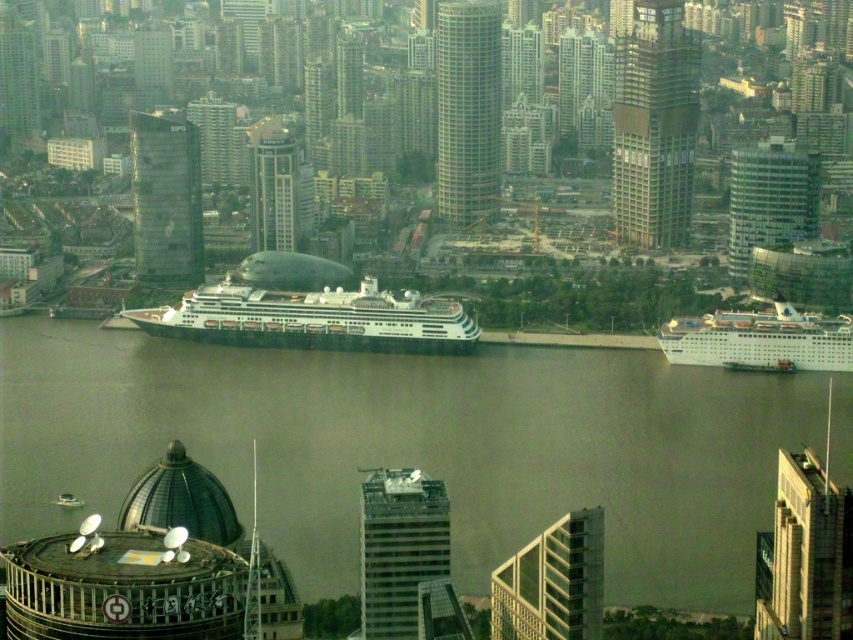
Question: Can you confirm if metallic glass skyscraper at center is bigger than white glossy cruise ship at right?

Choices:
 (A) no
 (B) yes

Answer: (A)

Question: Which point appears closest to the camera in this image?

Choices:
 (A) click(293, 179)
 (B) click(753, 368)
 (C) click(207, 134)
 (D) click(164, 132)

Answer: (A)

Question: Which point is closer to the camera?

Choices:
 (A) (70, 500)
 (B) (523, 566)
 (C) (173, 250)
 (D) (218, 163)

Answer: (B)

Question: Estimate the real-world distances between objects in this image. Which object is closer to the brown water at center?

Choices:
 (A) smooth glass skyscraper at center
 (B) matte glass skyscraper at center

Answer: (A)

Question: Is green glass tower at center to the right of glassy reflective skyscraper at center from the viewer's perspective?

Choices:
 (A) yes
 (B) no

Answer: (A)

Question: Does white glossy cruise ship at center appear under glassy reflective skyscraper at center?

Choices:
 (A) yes
 (B) no

Answer: (A)